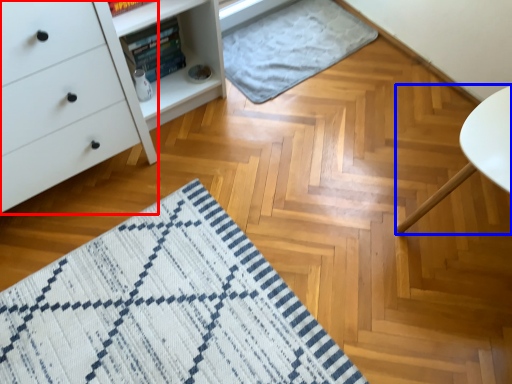
Question: Which of the following is the farthest to the observer, chest of drawers (highlighted by a red box) or furniture (highlighted by a blue box)?

Choices:
 (A) chest of drawers
 (B) furniture

Answer: (B)